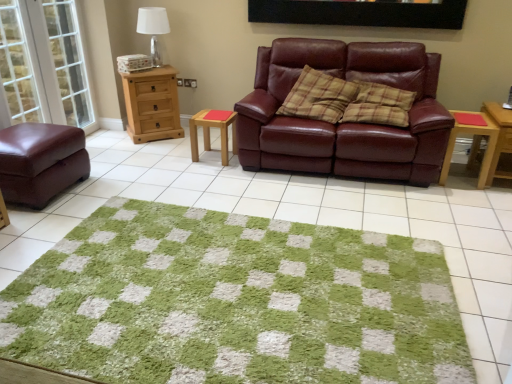
The height and width of the screenshot is (384, 512). In order to click on vacant area that is in front of natural wood chest of drawers at left in this screenshot , I will do `click(154, 147)`.